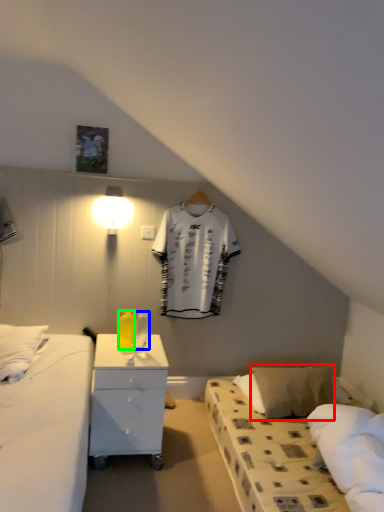
Question: Which object is positioned farthest from pillow (highlighted by a red box)? Select from bottle (highlighted by a blue box) and bottle (highlighted by a green box).

Choices:
 (A) bottle
 (B) bottle

Answer: (B)